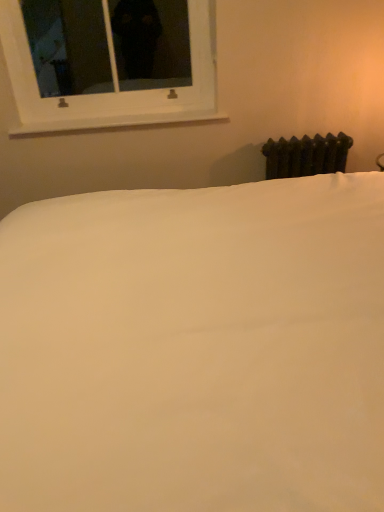
Question: Would you say dark green cast iron radiator at right is outside white plastic window at upper left?

Choices:
 (A) yes
 (B) no

Answer: (A)

Question: Is dark green cast iron radiator at right at the right side of white plastic window at upper left?

Choices:
 (A) yes
 (B) no

Answer: (A)

Question: Is dark green cast iron radiator at right directly adjacent to white plastic window at upper left?

Choices:
 (A) no
 (B) yes

Answer: (A)

Question: From the image's perspective, is dark green cast iron radiator at right under white plastic window at upper left?

Choices:
 (A) yes
 (B) no

Answer: (A)

Question: From a real-world perspective, is dark green cast iron radiator at right on top of white plastic window at upper left?

Choices:
 (A) yes
 (B) no

Answer: (B)

Question: In the image, is white smooth window sill at upper center positioned in front of or behind white smooth bed at center?

Choices:
 (A) behind
 (B) front

Answer: (A)

Question: From their relative heights in the image, would you say white smooth window sill at upper center is taller or shorter than white smooth bed at center?

Choices:
 (A) short
 (B) tall

Answer: (A)

Question: Is white smooth window sill at upper center situated inside white smooth bed at center or outside?

Choices:
 (A) outside
 (B) inside

Answer: (A)

Question: Considering the positions of point (158, 122) and point (26, 206), is point (158, 122) closer or farther from the camera than point (26, 206)?

Choices:
 (A) closer
 (B) farther

Answer: (B)

Question: Is white smooth window sill at upper center spatially inside white plastic window at upper left, or outside of it?

Choices:
 (A) inside
 (B) outside

Answer: (A)

Question: From the image's perspective, relative to white plastic window at upper left, is white smooth window sill at upper center above or below?

Choices:
 (A) below
 (B) above

Answer: (A)

Question: From a real-world perspective, is white smooth window sill at upper center physically located above or below white plastic window at upper left?

Choices:
 (A) above
 (B) below

Answer: (B)

Question: From their relative heights in the image, would you say white smooth window sill at upper center is taller or shorter than white plastic window at upper left?

Choices:
 (A) tall
 (B) short

Answer: (B)

Question: Considering the positions of point (137, 114) and point (69, 244), is point (137, 114) closer or farther from the camera than point (69, 244)?

Choices:
 (A) farther
 (B) closer

Answer: (A)

Question: Considering the positions of white plastic window at upper left and white smooth bed at center in the image, is white plastic window at upper left wider or thinner than white smooth bed at center?

Choices:
 (A) wide
 (B) thin

Answer: (B)